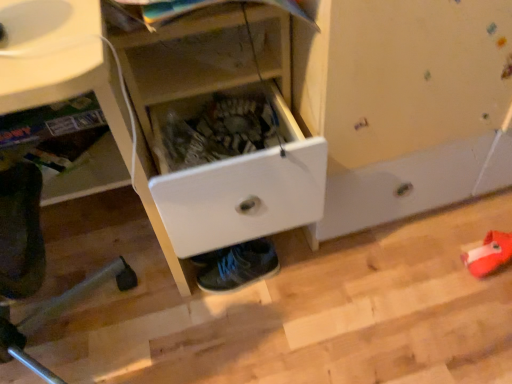
At what (x,y) coordinates should I click in order to perform the action: click on free space to the right of white plastic drawer at lower center. Please return your answer as a coordinate pair (x, y). Looking at the image, I should click on (211, 332).